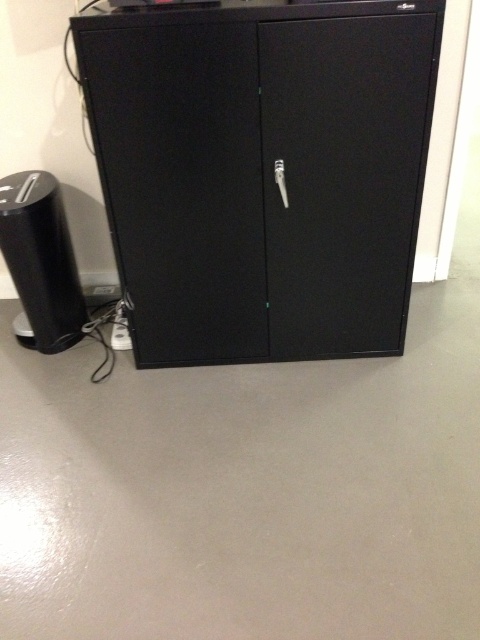
Does matte black cabinet at center have a greater height compared to black matte speaker at left?

Yes.

Which is below, matte black cabinet at center or black matte speaker at left?

black matte speaker at left

Where is `matte black cabinet at center`? matte black cabinet at center is located at coordinates (263, 172).